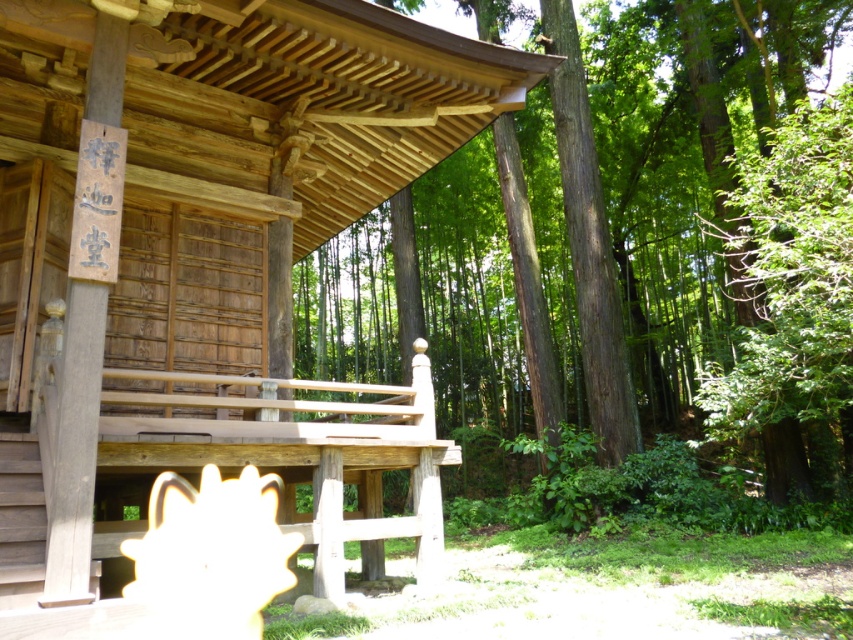
Question: Does wooden cabin at center appear on the left side of smooth brown tree trunk at center?

Choices:
 (A) yes
 (B) no

Answer: (A)

Question: Which point is farther from the camera taking this photo?

Choices:
 (A) (41, 44)
 (B) (538, 227)

Answer: (B)

Question: Does wooden cabin at center appear under smooth brown tree trunk at center?

Choices:
 (A) no
 (B) yes

Answer: (B)

Question: Among these objects, which one is farthest from the camera?

Choices:
 (A) wooden cabin at center
 (B) smooth brown tree trunk at center

Answer: (B)

Question: Is wooden cabin at center above smooth brown tree trunk at center?

Choices:
 (A) no
 (B) yes

Answer: (A)